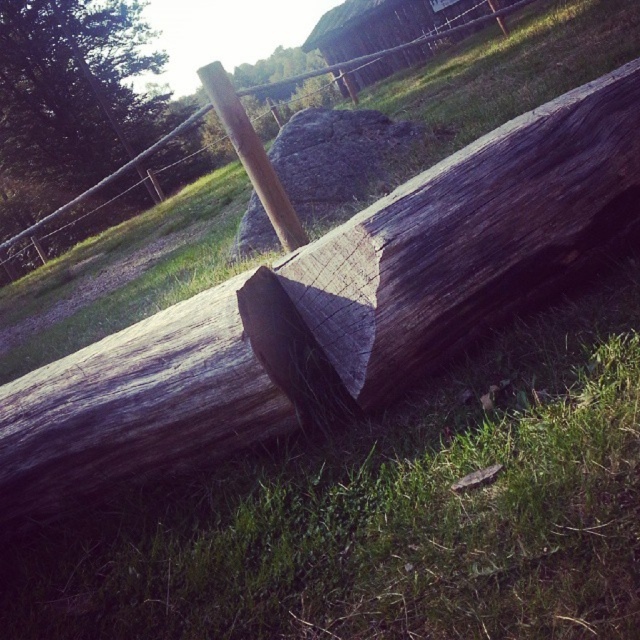
In the scene shown: You are a gardener trying to plant a small flower in the green grass at center. You notice the weathered wood post at center nearby. Where should you place the flower so it won

The green grass at center is below the weathered wood post at center, so you should plant the flower in the green grass at center to ensure it gets enough sunlight, as placing it under the post might block the light.

You are standing at the camera position looking at the rustic outdoor scene. There are two points marked in the image, one at coordinates point (480, 531) and another at point (349, 61). Which of these points is nearer to your current position?

Point (480, 531) is closer to the camera than point (349, 61), so the point at coordinates point (480, 531) is nearer to your current position.

You are standing at the point with coordinates (332,310) in the image. What object is located exactly at your current position? Please answer using the object labels from the scene description.

The weathered wood log at center is located exactly at the point with coordinates (332,310).